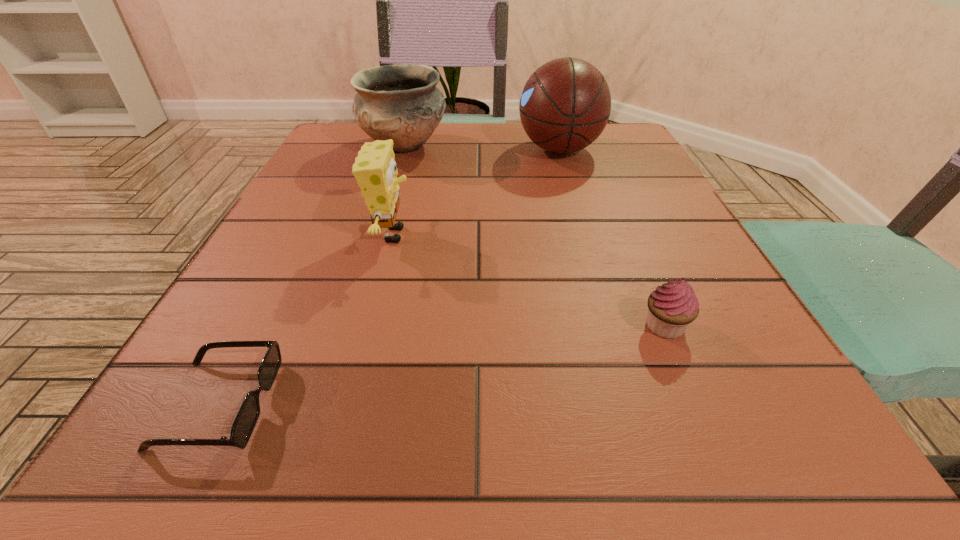
Where is `free space located on the back of the fourth farthest object`? The image size is (960, 540). free space located on the back of the fourth farthest object is located at coordinates (618, 218).

In order to click on vacant space located on the front-facing side of the shortest object in this screenshot , I will do `click(355, 404)`.

Locate an element on the screen. The width and height of the screenshot is (960, 540). basketball located in the far edge section of the desktop is located at coordinates (565, 105).

I want to click on pottery that is at the far edge, so click(401, 102).

This screenshot has width=960, height=540. Identify the location of object that is positioned at the near edge. (247, 417).

The image size is (960, 540). What are the coordinates of `pottery that is at the left edge` in the screenshot? It's located at (401, 102).

At what (x,y) coordinates should I click in order to perform the action: click on sunglasses that is at the left edge. Please return your answer as a coordinate pair (x, y). The height and width of the screenshot is (540, 960). Looking at the image, I should click on (247, 417).

This screenshot has width=960, height=540. I want to click on basketball that is positioned at the right edge, so click(565, 105).

This screenshot has height=540, width=960. Find the location of `cupcake positioned at the right edge`. cupcake positioned at the right edge is located at coordinates (673, 306).

Where is `object present at the far left corner`? This screenshot has width=960, height=540. object present at the far left corner is located at coordinates (401, 102).